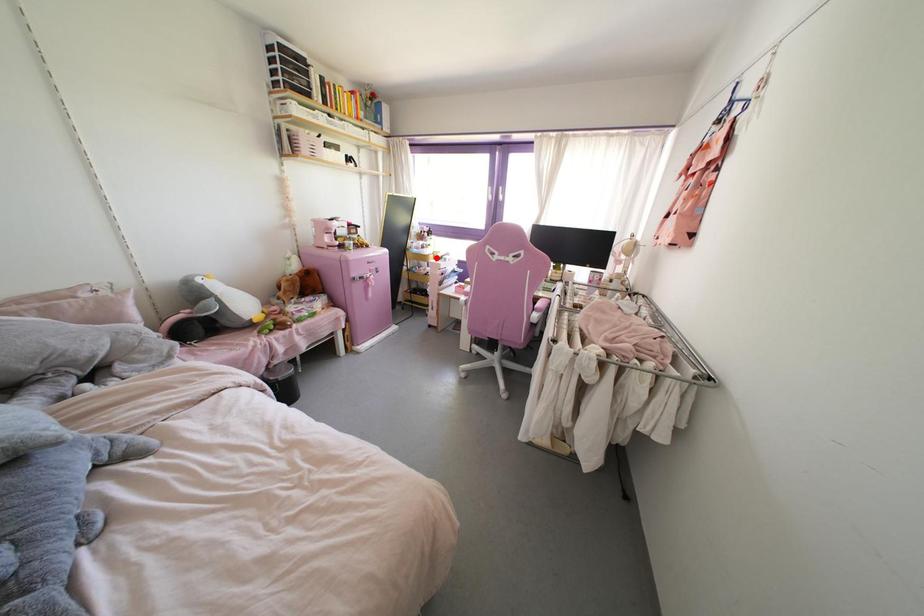
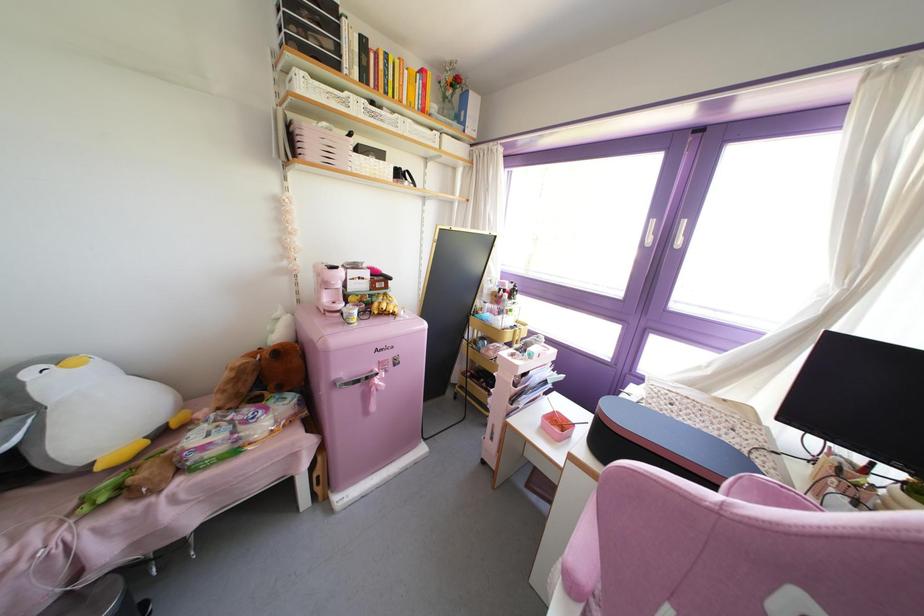
Where in the second image is the point corresponding to the highlighted location from the first image?

(516, 345)